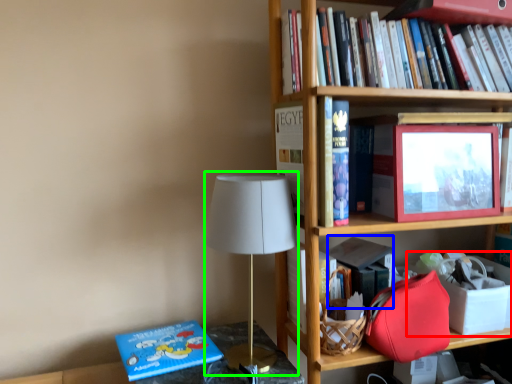
Question: Which is farther away from box (highlighted by a red box)? paperback book (highlighted by a blue box) or table lamp (highlighted by a green box)?

Choices:
 (A) paperback book
 (B) table lamp

Answer: (B)